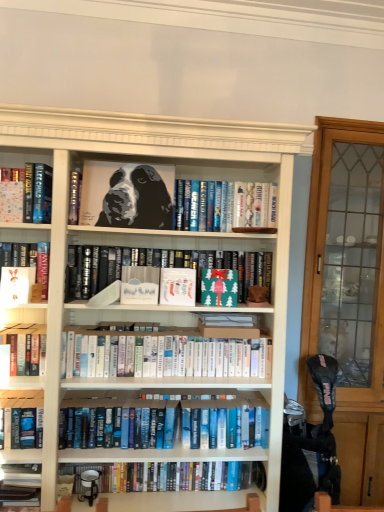
Question: Considering the relative sizes of matte paper book at left, placed as the fifth paperback book when sorted from right to left, and black matte portrait at upper center, the first book positioned from the top, in the image provided, is matte paper book at left, placed as the fifth paperback book when sorted from right to left, bigger than black matte portrait at upper center, the first book positioned from the top,?

Choices:
 (A) yes
 (B) no

Answer: (B)

Question: Is matte paper book at left, placed as the fifth paperback book when sorted from right to left, to the right of black matte portrait at upper center, the first book positioned from the top, from the viewer's perspective?

Choices:
 (A) yes
 (B) no

Answer: (B)

Question: Is matte paper book at left, which ranks as the 1th paperback book in left-to-right order, positioned far away from black matte portrait at upper center, which is the 7th book in bottom-to-top order?

Choices:
 (A) yes
 (B) no

Answer: (B)

Question: Is black matte portrait at upper center, which is the 7th book in bottom-to-top order, completely or partially inside matte paper book at left, which ranks as the 1th paperback book in left-to-right order?

Choices:
 (A) yes
 (B) no

Answer: (B)

Question: From a real-world perspective, is matte paper book at left, placed as the fifth paperback book when sorted from right to left, on black matte portrait at upper center, the first book positioned from the top?

Choices:
 (A) no
 (B) yes

Answer: (A)

Question: Could you tell me if matte paper book at left, placed as the fifth paperback book when sorted from right to left, is turned towards black matte portrait at upper center, the first book positioned from the top?

Choices:
 (A) no
 (B) yes

Answer: (A)

Question: Can you confirm if matte paper book at left, placed as the fifth paperback book when sorted from right to left, is thinner than matte black book at center, placed as the 3th book when sorted from top to bottom?

Choices:
 (A) no
 (B) yes

Answer: (B)

Question: From a real-world perspective, is matte paper book at left, which ranks as the 1th paperback book in left-to-right order, on top of matte black book at center, the 5th book in the bottom-to-top sequence?

Choices:
 (A) yes
 (B) no

Answer: (A)

Question: Can you confirm if matte paper book at left, which ranks as the 1th paperback book in left-to-right order, is smaller than matte black book at center, the 5th book in the bottom-to-top sequence?

Choices:
 (A) no
 (B) yes

Answer: (B)

Question: Does matte paper book at left, placed as the fifth paperback book when sorted from right to left, have a larger size compared to matte black book at center, placed as the 3th book when sorted from top to bottom?

Choices:
 (A) yes
 (B) no

Answer: (B)

Question: Is the depth of matte paper book at left, placed as the fifth paperback book when sorted from right to left, greater than that of matte black book at center, the 5th book in the bottom-to-top sequence?

Choices:
 (A) yes
 (B) no

Answer: (B)

Question: Is matte paper book at left, placed as the fifth paperback book when sorted from right to left, looking in the opposite direction of matte black book at center, placed as the 3th book when sorted from top to bottom?

Choices:
 (A) no
 (B) yes

Answer: (A)

Question: Is white matte paper at center, the 3th paperback book positioned from the right, aimed at black glossy painting of a dog at center?

Choices:
 (A) no
 (B) yes

Answer: (A)